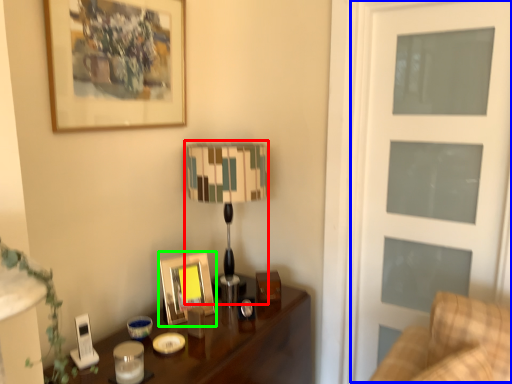
Question: Considering the real-world distances, which object is closest to table lamp (highlighted by a red box)? screen door (highlighted by a blue box) or picture frame (highlighted by a green box).

Choices:
 (A) screen door
 (B) picture frame

Answer: (B)